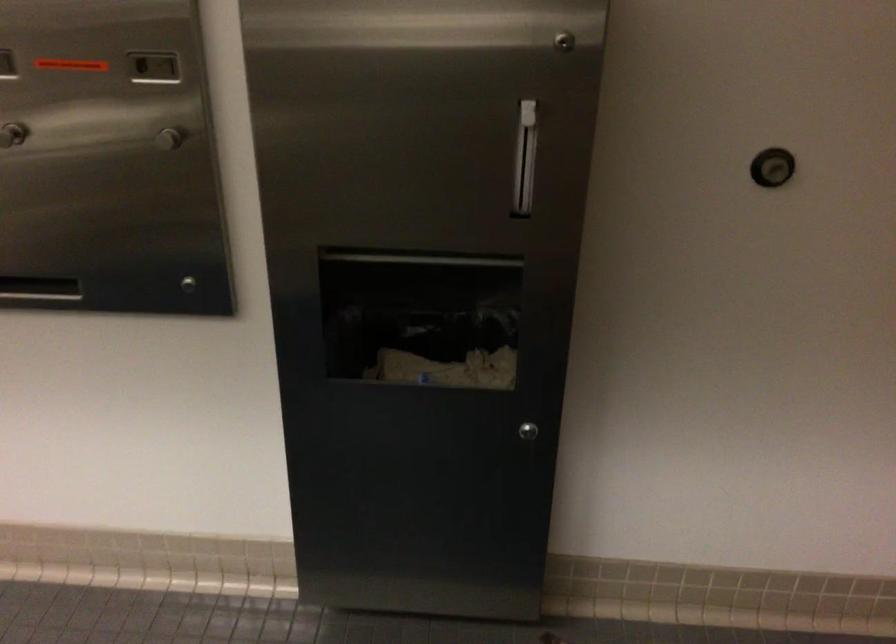
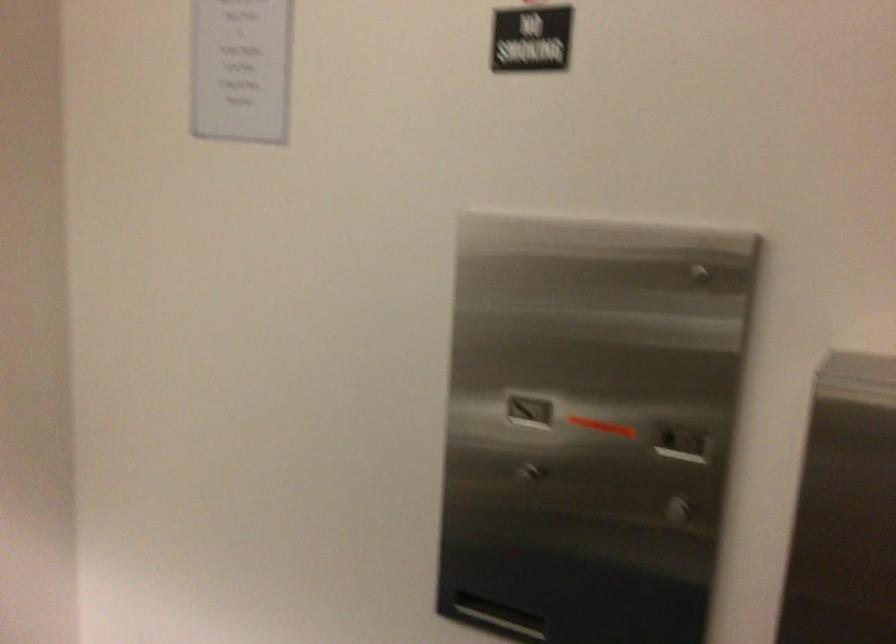
Locate, in the second image, the point that corresponds to [76,88] in the first image.

(600, 424)